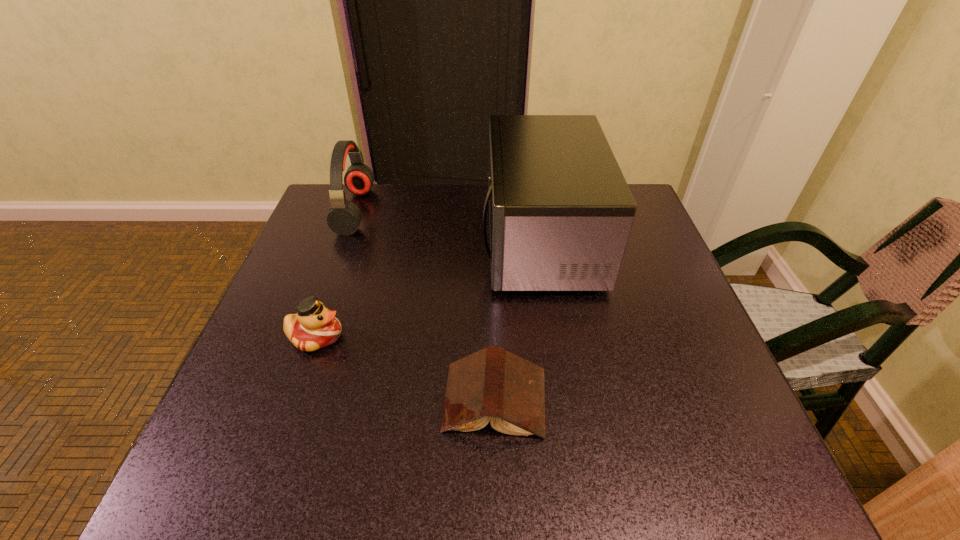
Locate an element on the screen. microwave oven is located at coordinates (560, 210).

This screenshot has height=540, width=960. I want to click on the third shortest object, so click(x=344, y=217).

Where is `the second shortest object`? The height and width of the screenshot is (540, 960). the second shortest object is located at coordinates (314, 326).

Find the location of a particular element. duck is located at coordinates (314, 326).

What are the coordinates of `book` in the screenshot? It's located at (492, 384).

This screenshot has height=540, width=960. I want to click on the nearest object, so click(492, 384).

Identify the location of free space located 0.150m on the front-facing side of the microwave oven. The image size is (960, 540). (423, 240).

Where is `free space located 0.290m on the front-facing side of the microwave oven`? Image resolution: width=960 pixels, height=540 pixels. free space located 0.290m on the front-facing side of the microwave oven is located at coordinates (368, 240).

The height and width of the screenshot is (540, 960). Identify the location of free space located on the front-facing side of the microwave oven. (463, 240).

The width and height of the screenshot is (960, 540). What are the coordinates of `free spot located 0.290m on the ear cups of the earphone` in the screenshot? It's located at (475, 211).